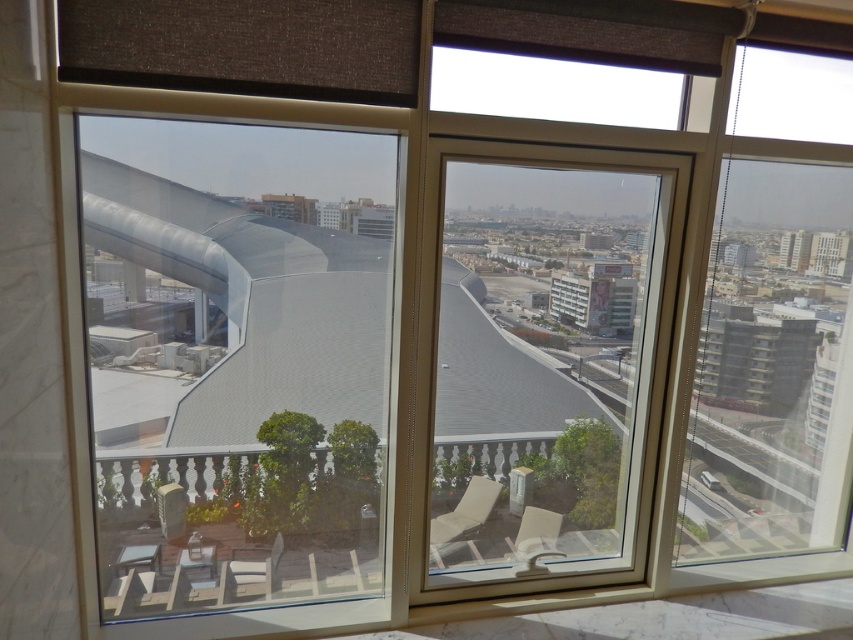
You are planning to place a large potted plant between the matte white chair at center and the matte beige chair at lower right on the balcony. Considering their sizes, which chair should the plant be closer to?

The matte white chair at center is bigger than the matte beige chair at lower right, so the plant should be placed closer to the matte white chair at center to maintain balance.

You are standing on the balcony and want to move to the modern architectural structure with the curved, metallic roof. Which direction should you move relative to the matte white lounge chair at center?

The matte white lounge chair at center is located at point (465,512). Since the modern architectural structure is in the middle ground beyond the balcony, you should move away from the matte white lounge chair at center towards the direction of the structure.